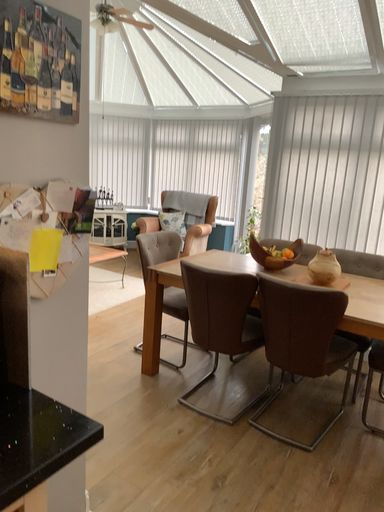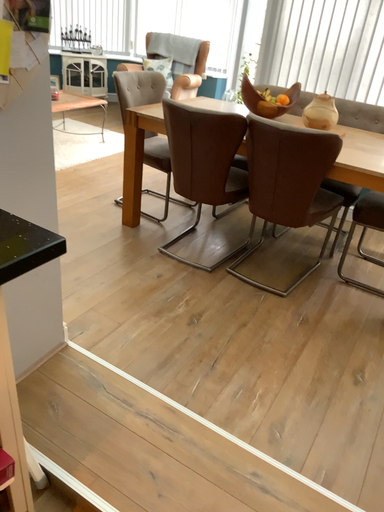
Question: Which way did the camera rotate in the video?

Choices:
 (A) rotated upward
 (B) rotated downward

Answer: (B)